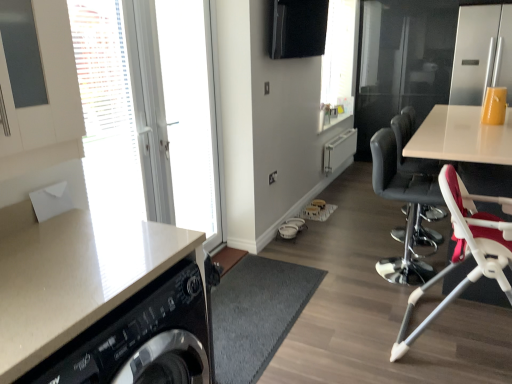
In order to click on vacant area that lies between black leather chair at right, which appears as the 2th chair when viewed from the front, and white glossy door at left, which is counted as the first window, starting from the back in this screenshot , I will do `click(301, 281)`.